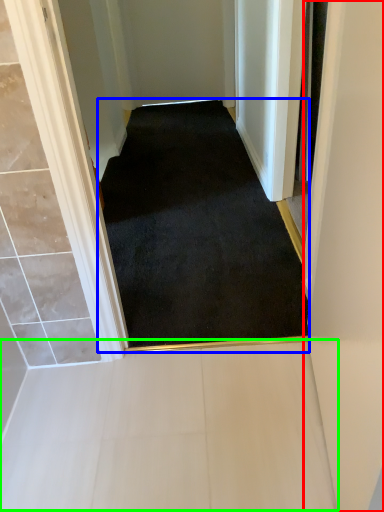
Question: Which object is the closest to the door (highlighted by a red box)? Choose among these: doormat (highlighted by a blue box) or path (highlighted by a green box).

Choices:
 (A) doormat
 (B) path

Answer: (B)